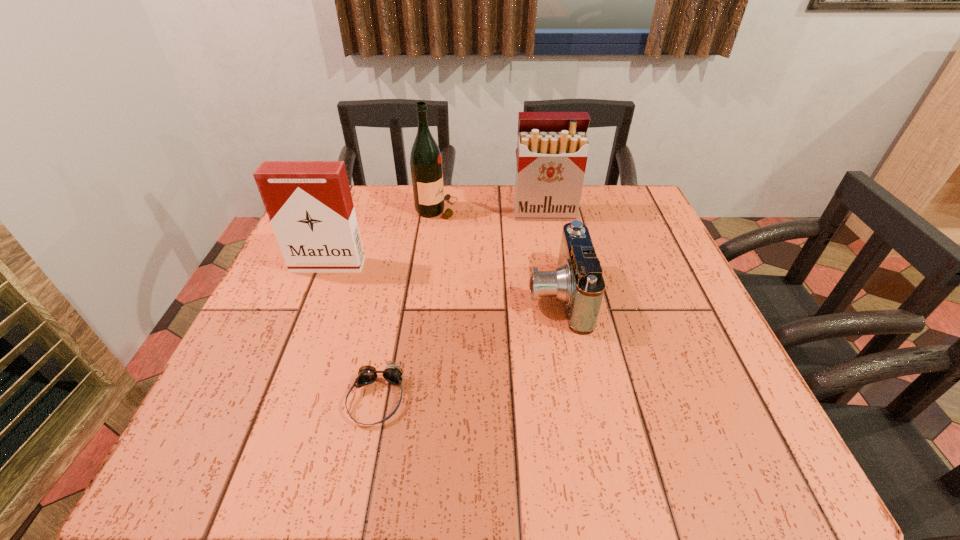
The height and width of the screenshot is (540, 960). I want to click on vacant area situated on the front-facing side of the second shortest object, so click(x=485, y=296).

The image size is (960, 540). What are the coordinates of `free region located on the front-facing side of the second shortest object` in the screenshot? It's located at (364, 296).

Locate an element on the screen. The image size is (960, 540). vacant point located 0.130m on the front-facing side of the second shortest object is located at coordinates (466, 296).

Where is `wine bottle located at the far edge`? wine bottle located at the far edge is located at coordinates (425, 161).

At what (x,y) coordinates should I click in order to perform the action: click on cigarette case present at the far edge. Please return your answer as a coordinate pair (x, y). Looking at the image, I should click on (552, 148).

Locate an element on the screen. object positioned at the near edge is located at coordinates pyautogui.click(x=367, y=374).

This screenshot has width=960, height=540. I want to click on object that is positioned at the left edge, so click(x=309, y=203).

Where is `vacant space at the far edge`? This screenshot has height=540, width=960. vacant space at the far edge is located at coordinates (439, 233).

You are a GUI agent. You are given a task and a screenshot of the screen. Output one action in this format:
    pyautogui.click(x=<x>, y=<y>)
    Task: Click on the free space at the near edge of the desktop
    The height and width of the screenshot is (540, 960).
    Given the screenshot: What is the action you would take?
    pyautogui.click(x=411, y=447)

The width and height of the screenshot is (960, 540). In the image, there is a desktop. Identify the location of free space at the left edge. (337, 303).